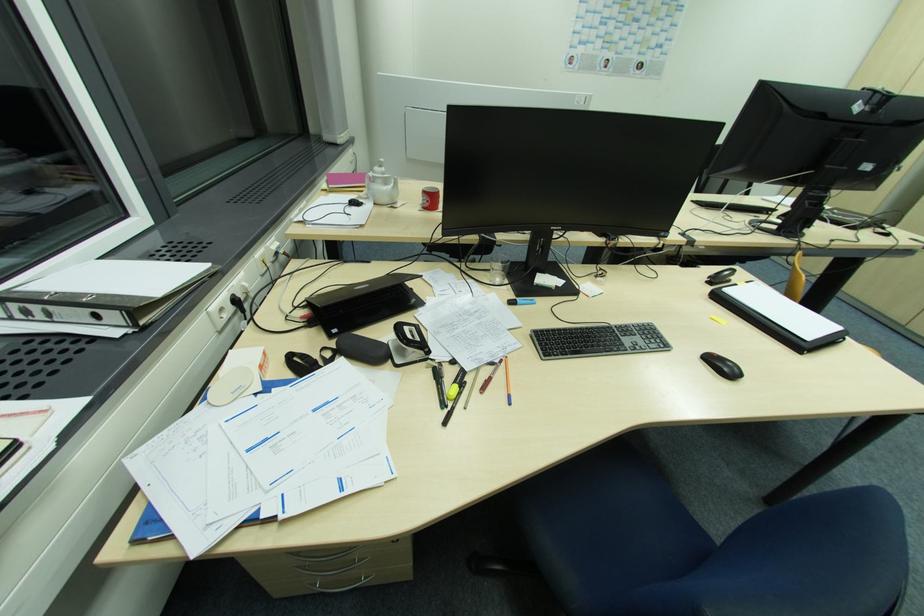
You are a GUI agent. You are given a task and a screenshot of the screen. Output one action in this format:
    pyautogui.click(x=<x>, y=<y>)
    Task: Click on the white dispenser lid
    The image size is (924, 616).
    Given the screenshot: What is the action you would take?
    pyautogui.click(x=232, y=386)